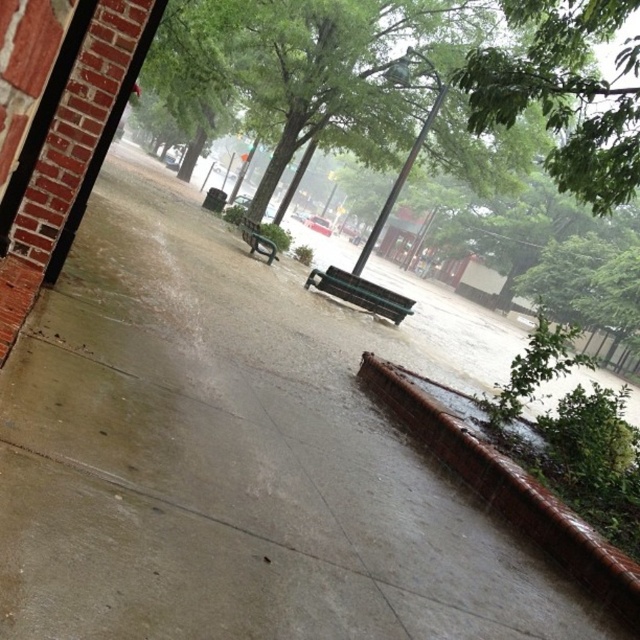
Question: Which object is farther from the camera taking this photo?

Choices:
 (A) green matte bench at center
 (B) green leafy tree at upper center
 (C) brown textured curb at lower right
 (D) metallic green bench at center

Answer: (D)

Question: Which is nearer to the brown textured curb at lower right?

Choices:
 (A) green matte bench at center
 (B) green leafy tree at upper center
 (C) metallic green bench at center

Answer: (B)

Question: Is the position of brown textured curb at lower right more distant than that of green matte bench at center?

Choices:
 (A) no
 (B) yes

Answer: (A)

Question: Considering the real-world distances, which object is farthest from the metallic green bench at center?

Choices:
 (A) brown textured curb at lower right
 (B) green leafy tree at upper center

Answer: (A)

Question: Is green leafy tree at upper center thinner than metallic green bench at center?

Choices:
 (A) yes
 (B) no

Answer: (B)

Question: Does green leafy tree at upper center have a larger size compared to green matte bench at center?

Choices:
 (A) no
 (B) yes

Answer: (B)